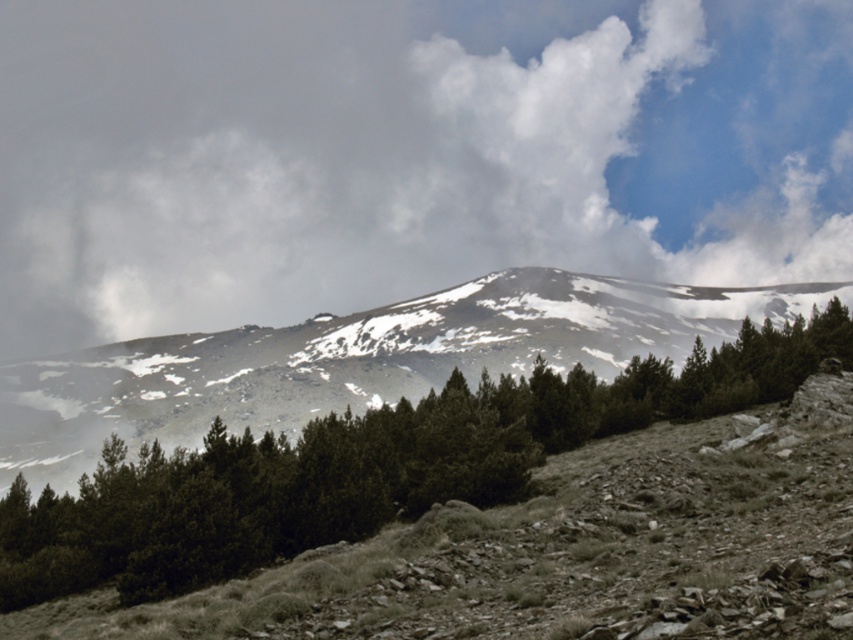
Question: Is white fluffy cloud at upper center behind green matte tree at center?

Choices:
 (A) yes
 (B) no

Answer: (A)

Question: Can you confirm if white fluffy cloud at upper center is positioned to the right of green matte tree at center?

Choices:
 (A) no
 (B) yes

Answer: (A)

Question: Which point is farther from the camera taking this photo?

Choices:
 (A) (364, 296)
 (B) (209, 477)

Answer: (A)

Question: Which of the following is the farthest from the observer?

Choices:
 (A) (25, 17)
 (B) (248, 532)

Answer: (A)

Question: Does white fluffy cloud at upper center appear on the right side of green matte tree at center?

Choices:
 (A) no
 (B) yes

Answer: (A)

Question: Which object appears farthest from the camera in this image?

Choices:
 (A) white fluffy cloud at upper center
 (B) green matte tree at center

Answer: (A)